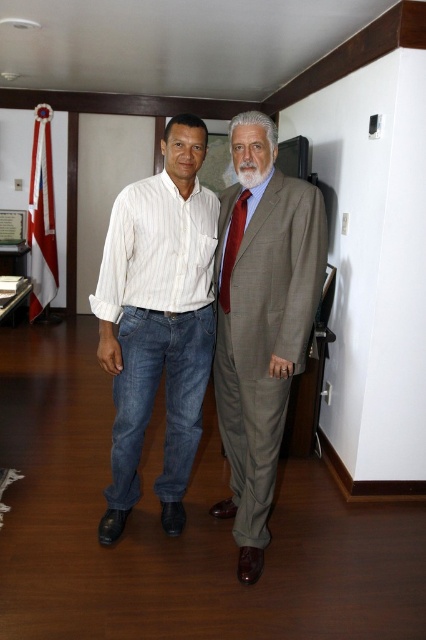
Between point (175, 404) and point (245, 195), which one is positioned in front?

Point (245, 195) is in front.

Is white striped shirt at center thinner than red silk tie at center?

In fact, white striped shirt at center might be wider than red silk tie at center.

Does point (134, 364) come closer to viewer compared to point (224, 310)?

Yes, point (134, 364) is in front of point (224, 310).

At what (x,y) coordinates should I click in order to perform the action: click on white striped shirt at center. Please return your answer as a coordinate pair (x, y). Looking at the image, I should click on (158, 321).

Does smooth brown suit at center appear on the left side of red silk tie at center?

In fact, smooth brown suit at center is to the right of red silk tie at center.

Which is in front, point (261, 340) or point (227, 253)?

Positioned in front is point (261, 340).

Which is in front, point (230, 218) or point (224, 273)?

Point (224, 273)

At what (x,y) coordinates should I click in order to perform the action: click on smooth brown suit at center. Please return your answer as a coordinate pair (x, y). Looking at the image, I should click on (261, 321).

Does white striped shirt at center have a lesser height compared to smooth brown suit at center?

Yes.

Who is positioned more to the left, white striped shirt at center or smooth brown suit at center?

white striped shirt at center

This screenshot has width=426, height=640. In order to click on white striped shirt at center in this screenshot , I will do `click(158, 321)`.